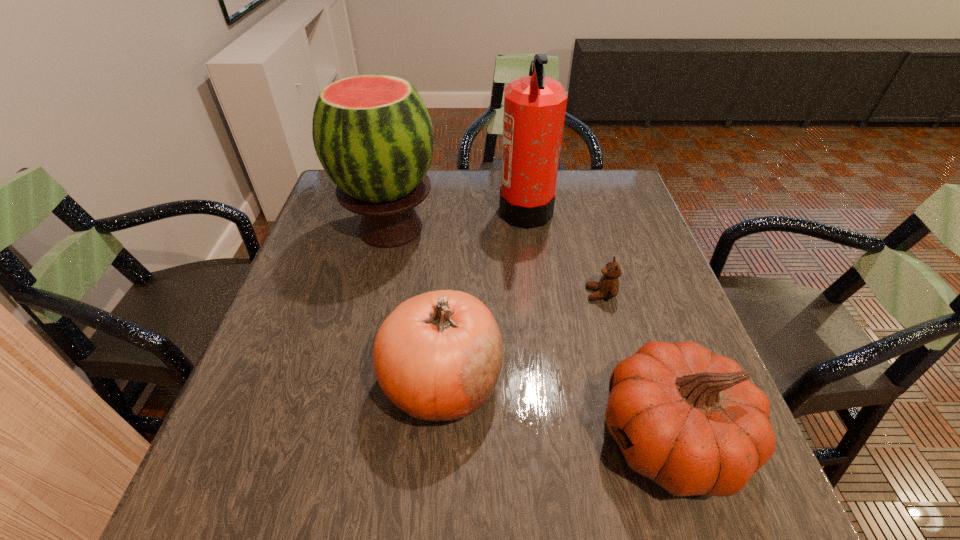
Locate an element on the screen. The image size is (960, 540). the tallest object is located at coordinates (534, 106).

Identify the location of the third object from left to right. The width and height of the screenshot is (960, 540). tap(534, 106).

Image resolution: width=960 pixels, height=540 pixels. What are the coordinates of `watermelon` in the screenshot? It's located at (373, 135).

Identify the location of the left pumpkin. (438, 356).

Locate an element on the screen. The height and width of the screenshot is (540, 960). the right pumpkin is located at coordinates (691, 420).

Where is `the shortest object`? The height and width of the screenshot is (540, 960). the shortest object is located at coordinates (608, 286).

Identify the location of teddy bear. (608, 286).

At what (x,y) coordinates should I click in order to perform the action: click on free space located 0.240m on the front side of the tallest object. Please return your answer as a coordinate pair (x, y). Looking at the image, I should click on (417, 209).

In order to click on vacant position located on the front side of the tallest object in this screenshot , I will do `click(471, 209)`.

Image resolution: width=960 pixels, height=540 pixels. Find the location of `vacant region located 0.220m on the front side of the tallest object`. vacant region located 0.220m on the front side of the tallest object is located at coordinates (423, 209).